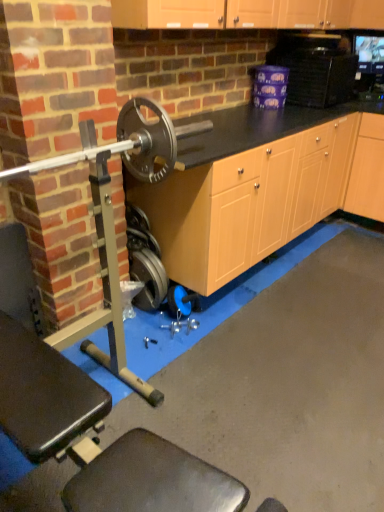
Question: Should I look upward or downward to see black plastic microwave at upper right?

Choices:
 (A) down
 (B) up

Answer: (B)

Question: From a real-world perspective, is metallic silver weight at lower center over polished silver barbell at left?

Choices:
 (A) no
 (B) yes

Answer: (A)

Question: Does metallic silver weight at lower center have a lesser height compared to polished silver barbell at left?

Choices:
 (A) no
 (B) yes

Answer: (A)

Question: From a real-world perspective, is metallic silver weight at lower center positioned under polished silver barbell at left based on gravity?

Choices:
 (A) no
 (B) yes

Answer: (B)

Question: Is metallic silver weight at lower center not inside polished silver barbell at left?

Choices:
 (A) yes
 (B) no

Answer: (A)

Question: Is there a large distance between metallic silver weight at lower center and polished silver barbell at left?

Choices:
 (A) yes
 (B) no

Answer: (B)

Question: Is polished silver barbell at left completely or partially inside metallic silver weight at lower center?

Choices:
 (A) no
 (B) yes

Answer: (A)

Question: Is black plastic microwave at upper right aimed at metallic silver weight at lower center?

Choices:
 (A) yes
 (B) no

Answer: (B)

Question: From a real-world perspective, is black plastic microwave at upper right beneath metallic silver weight at lower center?

Choices:
 (A) no
 (B) yes

Answer: (A)

Question: Considering the relative sizes of black plastic microwave at upper right and metallic silver weight at lower center in the image provided, is black plastic microwave at upper right taller than metallic silver weight at lower center?

Choices:
 (A) no
 (B) yes

Answer: (A)

Question: Is black plastic microwave at upper right looking in the opposite direction of metallic silver weight at lower center?

Choices:
 (A) no
 (B) yes

Answer: (A)

Question: Does black plastic microwave at upper right lie in front of metallic silver weight at lower center?

Choices:
 (A) yes
 (B) no

Answer: (B)

Question: Can you confirm if black plastic microwave at upper right is thinner than metallic silver weight at lower center?

Choices:
 (A) no
 (B) yes

Answer: (A)

Question: Is black plastic microwave at upper right thinner than polished silver barbell at left?

Choices:
 (A) no
 (B) yes

Answer: (A)